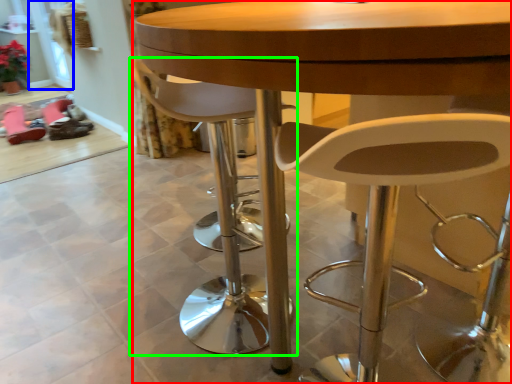
Question: Based on their relative distances, which object is farther from table (highlighted by a red box)? Choose from glass door (highlighted by a blue box) and chair (highlighted by a green box).

Choices:
 (A) glass door
 (B) chair

Answer: (A)